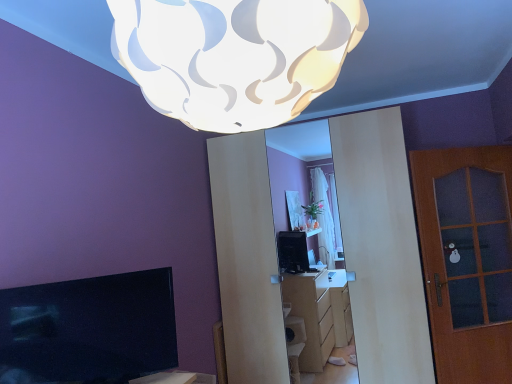
Question: Does matte black tv at lower left lie behind brown wooden door at right?

Choices:
 (A) no
 (B) yes

Answer: (A)

Question: Is matte black tv at lower left touching brown wooden door at right?

Choices:
 (A) no
 (B) yes

Answer: (A)

Question: From the image's perspective, is matte black tv at lower left below brown wooden door at right?

Choices:
 (A) yes
 (B) no

Answer: (A)

Question: Is matte black tv at lower left aimed at brown wooden door at right?

Choices:
 (A) yes
 (B) no

Answer: (B)

Question: From a real-world perspective, is matte black tv at lower left on brown wooden door at right?

Choices:
 (A) no
 (B) yes

Answer: (B)

Question: Considering the relative sizes of matte black tv at lower left and brown wooden door at right in the image provided, is matte black tv at lower left shorter than brown wooden door at right?

Choices:
 (A) no
 (B) yes

Answer: (B)

Question: Is white textured lampshade at upper center bigger than brown wooden door at right?

Choices:
 (A) no
 (B) yes

Answer: (B)

Question: From a real-world perspective, is white textured lampshade at upper center located beneath brown wooden door at right?

Choices:
 (A) yes
 (B) no

Answer: (B)

Question: Is white textured lampshade at upper center not within brown wooden door at right?

Choices:
 (A) no
 (B) yes

Answer: (B)

Question: Is the position of white textured lampshade at upper center less distant than that of brown wooden door at right?

Choices:
 (A) no
 (B) yes

Answer: (B)

Question: From a real-world perspective, is white textured lampshade at upper center positioned over brown wooden door at right based on gravity?

Choices:
 (A) no
 (B) yes

Answer: (B)

Question: Is the position of white textured lampshade at upper center more distant than that of brown wooden door at right?

Choices:
 (A) no
 (B) yes

Answer: (A)

Question: Are brown wooden door at right and white textured lampshade at upper center far apart?

Choices:
 (A) yes
 (B) no

Answer: (A)